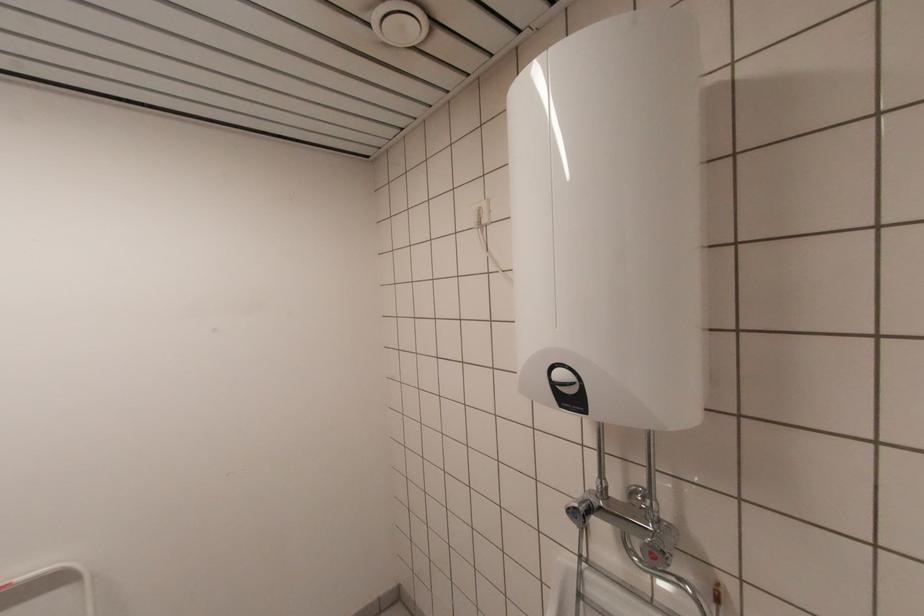
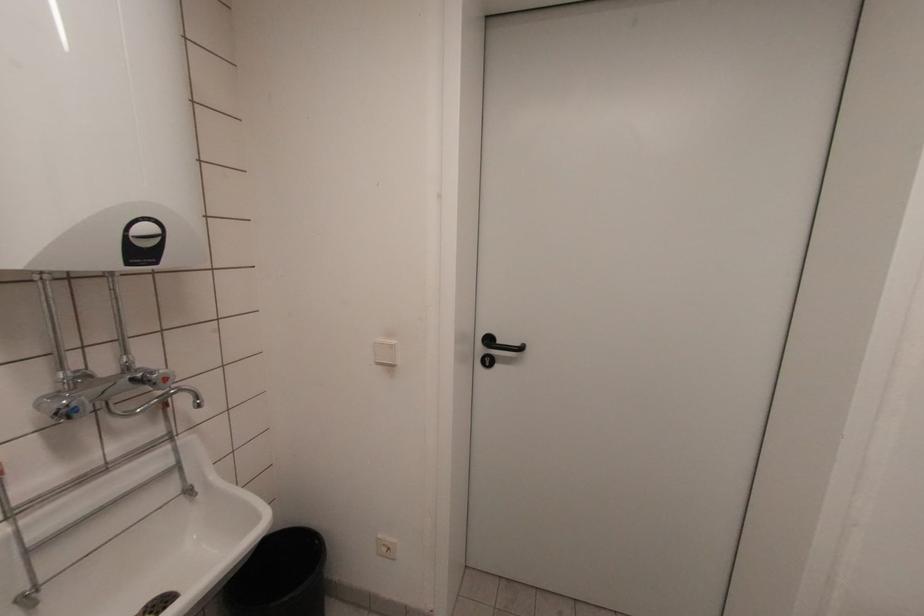
Find the pixel in the second image that matches point (578, 408) in the first image.

(151, 261)